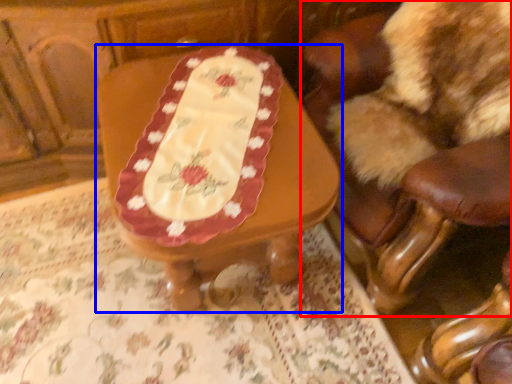
Question: Which point is further to the camera, chair (highlighted by a red box) or table (highlighted by a blue box)?

Choices:
 (A) chair
 (B) table

Answer: (B)